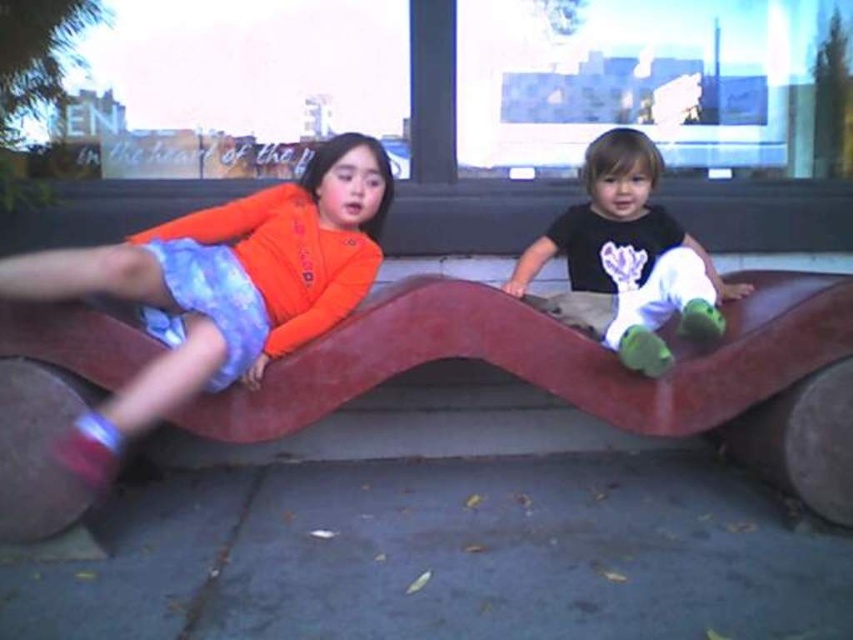
Does matte orange shirt at upper left have a lesser width compared to matte black shirt at upper right?

No, matte orange shirt at upper left is not thinner than matte black shirt at upper right.

Who is taller, matte orange shirt at upper left or matte black shirt at upper right?

matte orange shirt at upper left is taller.

Is point (161, 364) positioned in front of point (650, 148)?

That is True.

You are a GUI agent. You are given a task and a screenshot of the screen. Output one action in this format:
    pyautogui.click(x=<x>, y=<y>)
    Task: Click on the matte orange shirt at upper left
    The image size is (853, 640).
    Given the screenshot: What is the action you would take?
    pyautogui.click(x=223, y=285)